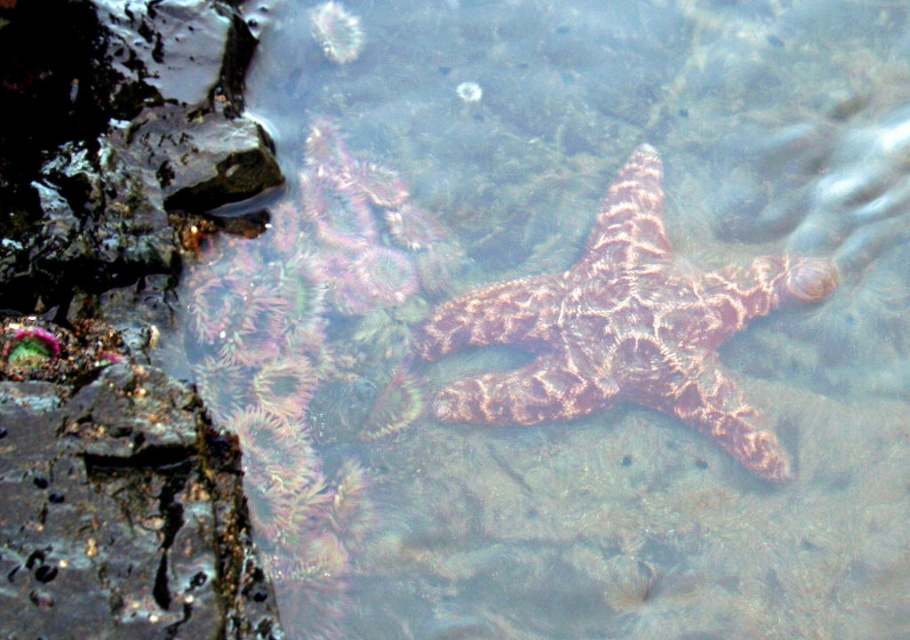
Based on the photo, you are a marine biologist holding a 3.5 feet long measuring tape. You want to measure the distance between the rusty metallic rock at left and the camera. Can your measuring tape reach that distance?

The distance between the rusty metallic rock at left and the camera is 4.48 feet, which is longer than your 3.5 feet measuring tape. Therefore, your measuring tape cannot reach the required distance.

You are a marine biologist observing the marine scene. You notice two points marked in the image. The first point is at coordinates point (160, 545) and the second is at point (685, 346). From your viewpoint, which point is closer to you?

Point (160, 545) is in front of point (685, 346), so the first point is closer to you.